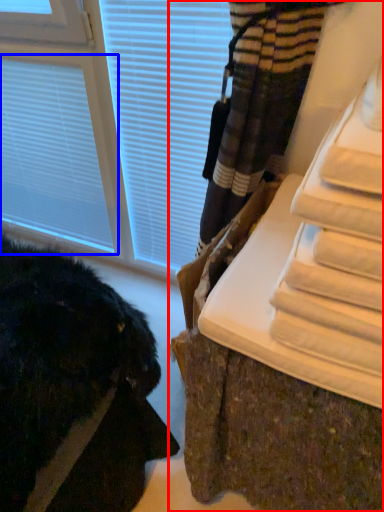
Question: Among these objects, which one is farthest to the camera, furniture (highlighted by a red box) or blind (highlighted by a blue box)?

Choices:
 (A) furniture
 (B) blind

Answer: (B)